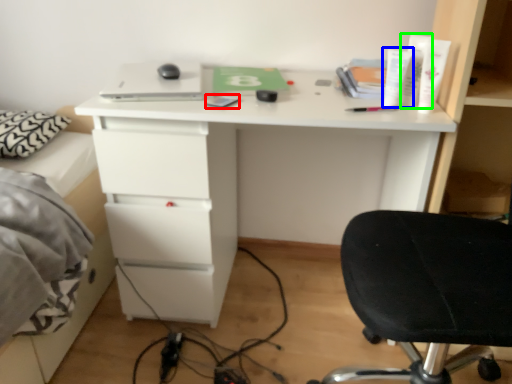
Question: Which object is the farthest from notepad (highlighted by a red box)? Choose among these: toiletry (highlighted by a blue box) or toiletry (highlighted by a green box).

Choices:
 (A) toiletry
 (B) toiletry

Answer: (B)